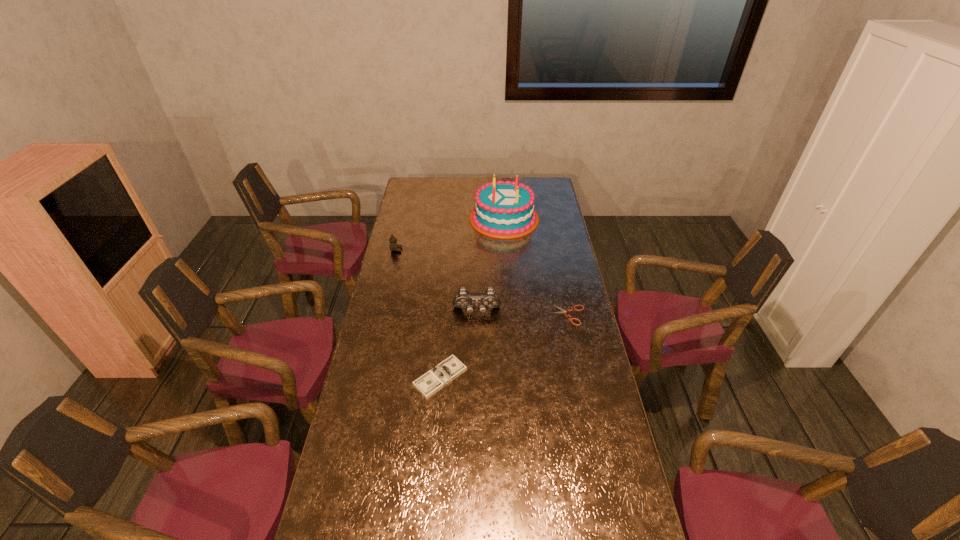
I want to click on free space located 0.300m on the face of the teddy bear, so click(467, 249).

This screenshot has height=540, width=960. I want to click on free location located 0.180m on the left of the dollar, so click(x=361, y=377).

In order to click on free region located 0.120m on the front of the shears in this screenshot , I will do `click(577, 350)`.

Locate an element on the screen. Image resolution: width=960 pixels, height=540 pixels. object present at the left edge is located at coordinates (393, 246).

The width and height of the screenshot is (960, 540). Find the location of `birthday cake that is at the right edge`. birthday cake that is at the right edge is located at coordinates (504, 209).

Locate an element on the screen. The image size is (960, 540). shears located at the right edge is located at coordinates (562, 310).

The image size is (960, 540). I want to click on free space at the left edge of the desktop, so click(376, 303).

The width and height of the screenshot is (960, 540). I want to click on vacant space at the right edge, so click(x=606, y=390).

Where is `vacant region at the far left corner of the desktop`? This screenshot has width=960, height=540. vacant region at the far left corner of the desktop is located at coordinates (407, 192).

This screenshot has width=960, height=540. Identify the location of vacant space that is in between the control and the shears. (523, 314).